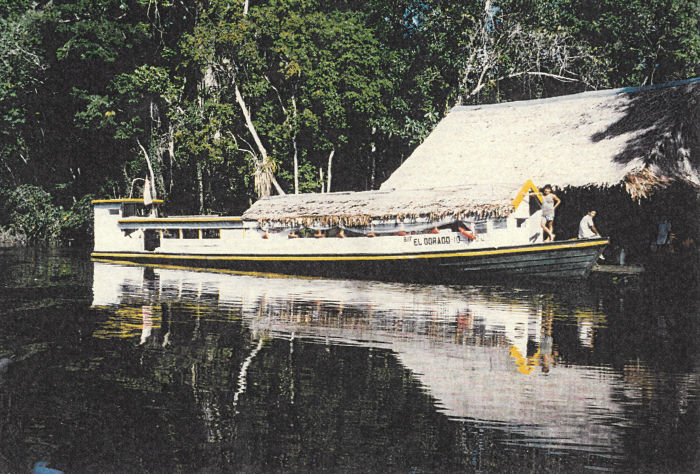
At what (x,y) coordinates should I click in order to perform the action: click on beam. Please return your answer as a coordinate pair (x, y). This screenshot has height=474, width=700. Looking at the image, I should click on (605, 91).